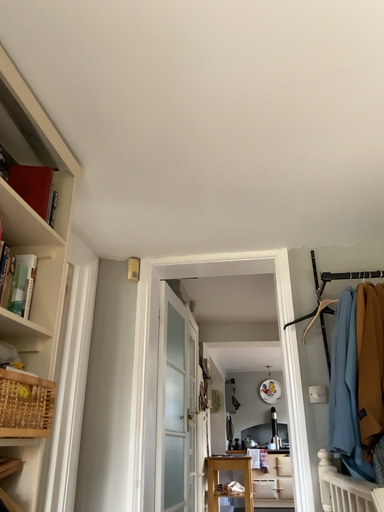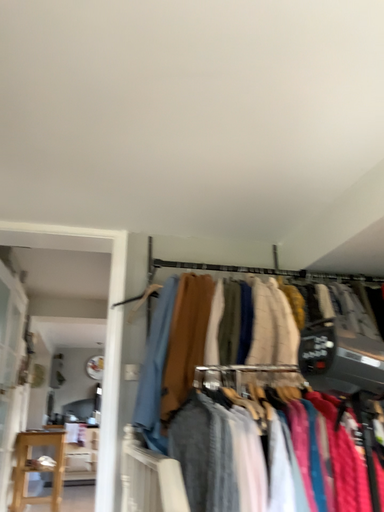
Question: How did the camera likely rotate when shooting the video?

Choices:
 (A) rotated left
 (B) rotated right

Answer: (B)